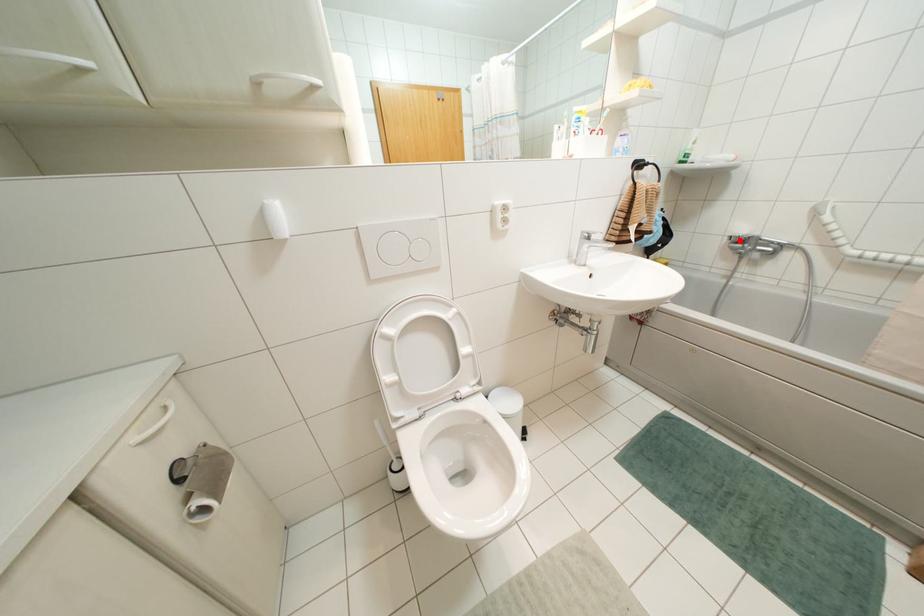
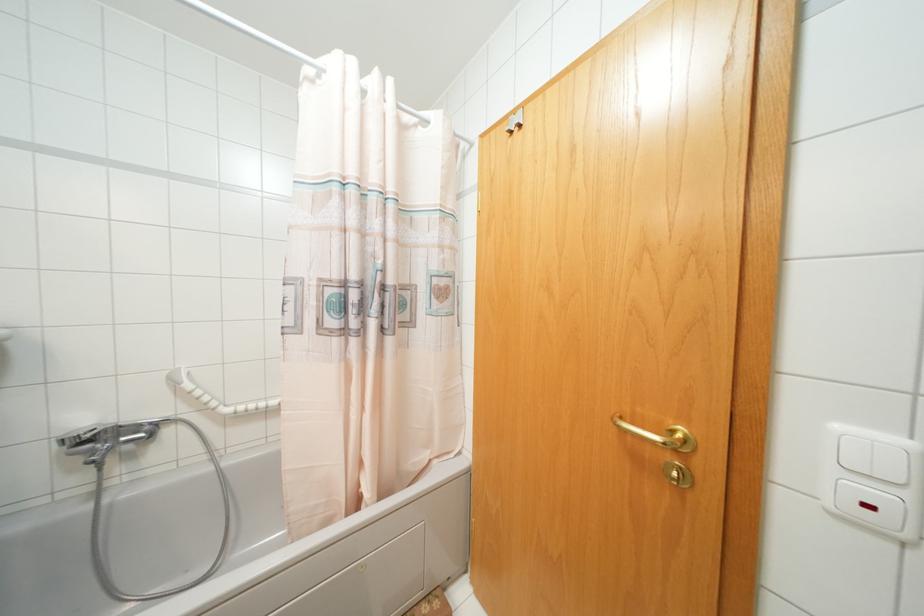
Where in the second image is the point corresponding to the highlighted location from the first image?

(84, 440)